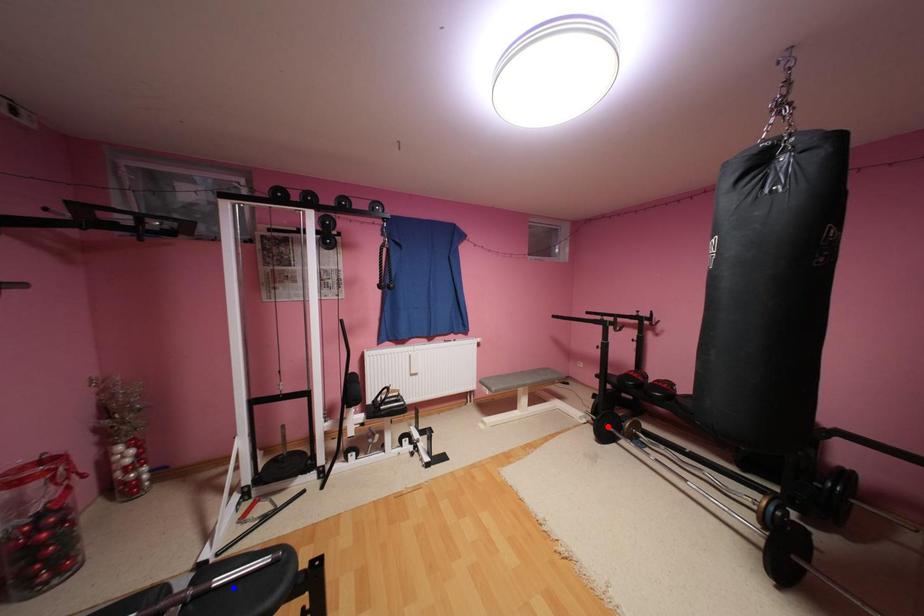
Question: Two points are marked on the image. Which point is closer to the camera?

Choices:
 (A) Blue point is closer.
 (B) Red point is closer.

Answer: (A)